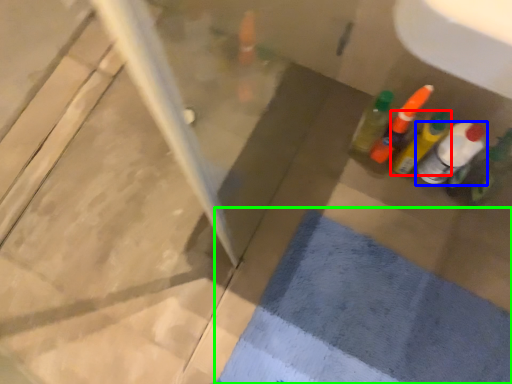
Question: Estimate the real-world distances between objects in this image. Which object is closer to bottle (highlighted by a red box), bottle (highlighted by a blue box) or bath mat (highlighted by a green box)?

Choices:
 (A) bottle
 (B) bath mat

Answer: (A)